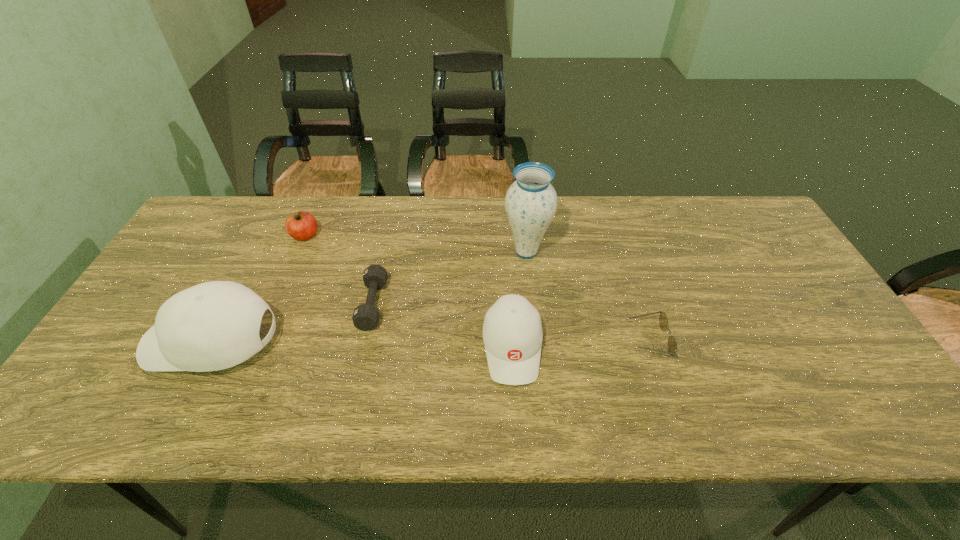
Identify the location of free space located 0.390m on the right of the third shortest object. The height and width of the screenshot is (540, 960). point(445,236).

Identify the location of vacant space located 0.100m on the front of the second shortest object. The height and width of the screenshot is (540, 960). (359, 366).

This screenshot has height=540, width=960. Identify the location of vacant area situated on the back of the tallest object. (521, 205).

Identify the location of vacant space located on the front-facing side of the rightmost object. (470, 340).

Where is `vacant region located 0.120m on the front-facing side of the rightmost object`? vacant region located 0.120m on the front-facing side of the rightmost object is located at coordinates (580, 340).

You are a GUI agent. You are given a task and a screenshot of the screen. Output one action in this format:
    pyautogui.click(x=<x>, y=<y>)
    Task: Click on the vacant space situated 0.320m on the front-facing side of the rightmost object
    
    Given the screenshot: What is the action you would take?
    pyautogui.click(x=498, y=340)

I want to click on apple that is at the far edge, so click(x=301, y=225).

Locate an element on the screen. This screenshot has height=540, width=960. vase that is at the far edge is located at coordinates (531, 201).

Where is `spectacles present at the near edge`? This screenshot has height=540, width=960. spectacles present at the near edge is located at coordinates (663, 321).

What are the coordinates of `object located at the left edge` in the screenshot? It's located at [x=215, y=325].